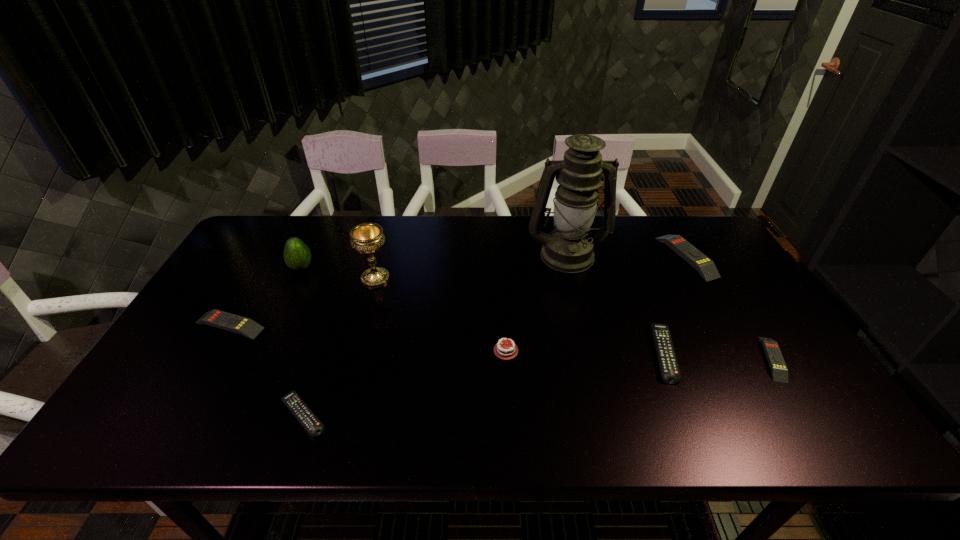
Find the location of a particular element. The height and width of the screenshot is (540, 960). free space located 0.290m on the left of the chocolate cake is located at coordinates (369, 350).

Identify the location of free space located 0.280m on the front of the leftmost yellow remote control. The image size is (960, 540). (163, 439).

The height and width of the screenshot is (540, 960). I want to click on vacant region located 0.260m on the right of the bigger black remote control, so click(x=779, y=353).

Locate an element on the screen. The height and width of the screenshot is (540, 960). vacant region located 0.050m on the front of the smallest yellow remote control is located at coordinates (x=799, y=402).

Image resolution: width=960 pixels, height=540 pixels. In order to click on free spot located 0.050m on the back of the nearer black remote control in this screenshot , I will do `click(317, 375)`.

Locate an element on the screen. oil lamp that is at the far edge is located at coordinates (569, 249).

At what (x,y) coordinates should I click in order to perform the action: click on remote control that is at the far edge. Please return your answer as a coordinate pair (x, y). This screenshot has height=540, width=960. Looking at the image, I should click on pyautogui.click(x=705, y=266).

In order to click on object present at the near edge in this screenshot , I will do `click(292, 400)`.

Image resolution: width=960 pixels, height=540 pixels. Find the location of `object that is at the left edge`. object that is at the left edge is located at coordinates (247, 327).

Where is `object present at the far right corner`? This screenshot has height=540, width=960. object present at the far right corner is located at coordinates (705, 266).